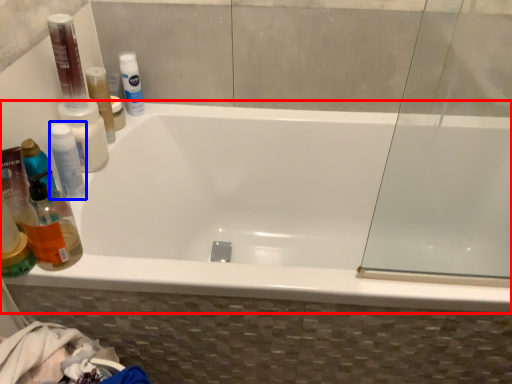
Question: Which object is further to the camera taking this photo, bathtub (highlighted by a red box) or mouthwash (highlighted by a blue box)?

Choices:
 (A) bathtub
 (B) mouthwash

Answer: (B)